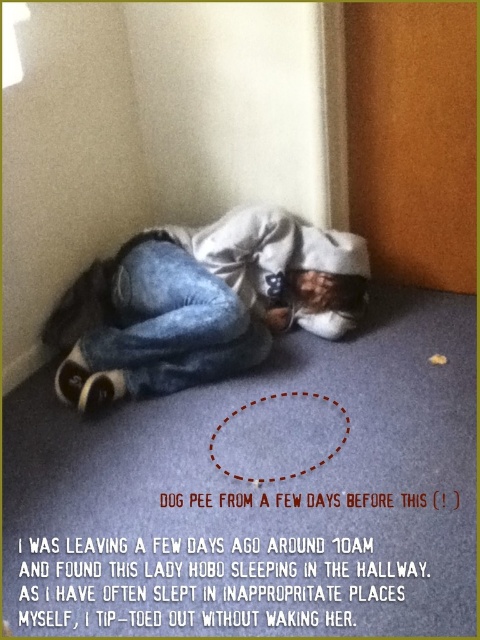
Does faded denim jacket at lower right have a lesser width compared to denim at lower left?

In fact, faded denim jacket at lower right might be wider than denim at lower left.

In the scene shown: Is faded denim jacket at lower right in front of denim at lower left?

No.

Locate an element on the screen. This screenshot has width=480, height=640. faded denim jacket at lower right is located at coordinates (203, 304).

At what (x,y) coordinates should I click in order to perform the action: click on faded denim jacket at lower right. Please return your answer as a coordinate pair (x, y). This screenshot has height=640, width=480. Looking at the image, I should click on (203, 304).